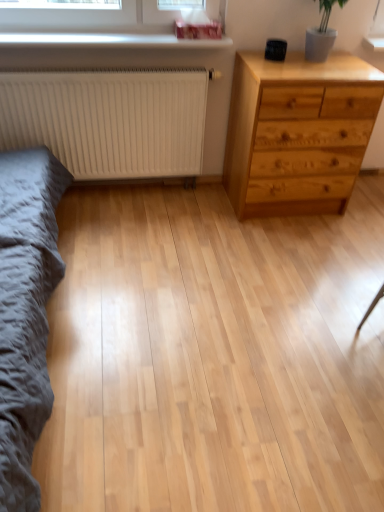
In order to click on free point to the left of natural wood chest of drawers at right in this screenshot , I will do `click(200, 213)`.